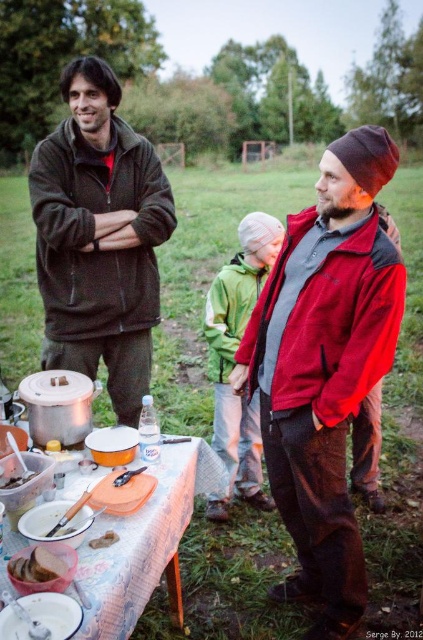
You are planning to place a 1.2 meter long wooden board on the table. The red fleece jacket at center and the white matte plate at lower left are currently on the table. Can the board fit horizontally between them?

The red fleece jacket at center is 1.26 meters away from the white matte plate at lower left. Since the distance between them is greater than the board length, the board can fit horizontally between them.

You are organizing the items on the picnic table and need to place the red fleece jacket at center and the smooth brown bread at center. According to the current arrangement, where should you place the bread relative to the jacket?

The red fleece jacket at center is positioned on the right side of the smooth brown bread at center, so the bread should be placed to the left of the jacket.

You are planning to place a small bowl of fruit on the table where the orange plastic tray at center and the smooth brown bread at center are located. Where should you put the bowl so that it is between these two items?

The orange plastic tray at center is positioned on the right side of smooth brown bread at center, so placing the bowl between them would require placing it to the right of the smooth brown bread at center and to the left of the orange plastic tray at center.